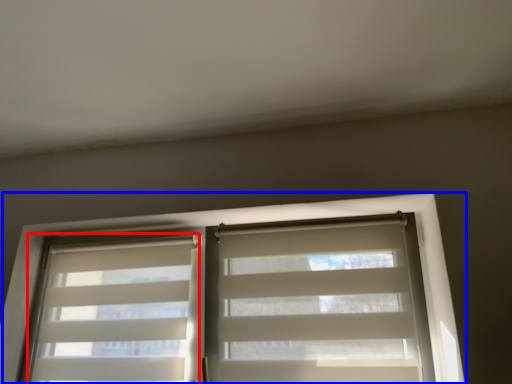
Question: Which object is further to the camera taking this photo, shutter (highlighted by a red box) or window (highlighted by a blue box)?

Choices:
 (A) shutter
 (B) window

Answer: (A)